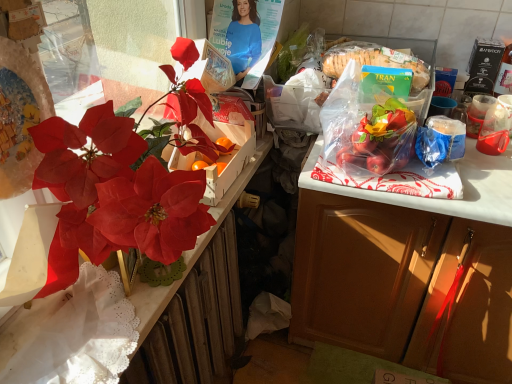
Question: In terms of width, does matte brown cabinet at right look wider or thinner when compared to white lace wrapping paper at left?

Choices:
 (A) wide
 (B) thin

Answer: (A)

Question: Is point (417, 274) positioned closer to the camera than point (98, 309)?

Choices:
 (A) farther
 (B) closer

Answer: (A)

Question: Considering the real-world distances, which object is farthest from the matte brown cabinet at right?

Choices:
 (A) transparent plastic coffee cup at upper right, which is the second coffee cup in right-to-left order
 (B) metallic radiator at left
 (C) matte red flower at left
 (D) transparent plastic cup at right, the 1th coffee cup viewed from the right
 (E) matte plastic flowers at left

Answer: (C)

Question: Which object is the closest to the matte brown cabinet at right?

Choices:
 (A) matte red flower at left
 (B) white lace wrapping paper at left
 (C) transparent plastic coffee cup at upper right, which is the second coffee cup in right-to-left order
 (D) matte plastic flowers at left
 (E) metallic radiator at left

Answer: (E)